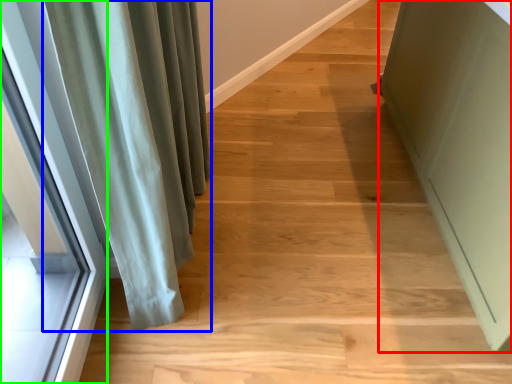
Question: Which is farther away from screen door (highlighted by a red box)? curtain (highlighted by a blue box) or window (highlighted by a green box)?

Choices:
 (A) curtain
 (B) window

Answer: (B)